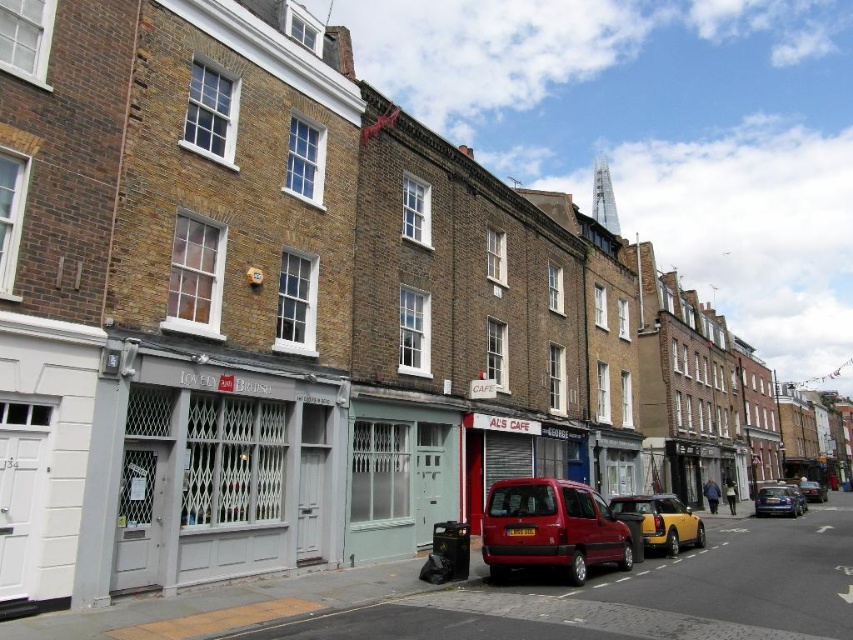
Does matte red van at center have a greater height compared to yellow metallic car at center?

Incorrect, matte red van at center's height is not larger of yellow metallic car at center's.

In the scene shown: Is matte red van at center behind yellow metallic car at center?

No, it is in front of yellow metallic car at center.

Who is more forward, (567, 547) or (799, 504)?

Positioned in front is point (567, 547).

This screenshot has height=640, width=853. I want to click on matte red van at center, so click(x=550, y=529).

Which is behind, point (125, 557) or point (795, 500)?

Point (795, 500)

Does point (164, 444) come in front of point (786, 512)?

Yes, point (164, 444) is in front of point (786, 512).

This screenshot has height=640, width=853. I want to click on matte gray storefront at center, so click(219, 465).

Is matte red van at center above yellow metallic taxi at center?

Yes, matte red van at center is above yellow metallic taxi at center.

Which is behind, point (602, 525) or point (665, 531)?

The point (665, 531) is behind.

Find the location of a particular element. matte red van at center is located at coordinates (550, 529).